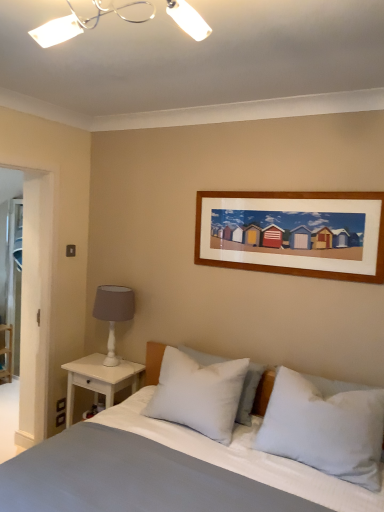
Question: Visually, is white matte table lamp at left positioned to the left or to the right of white plastic light fixture at upper center?

Choices:
 (A) left
 (B) right

Answer: (A)

Question: From a real-world perspective, is white matte table lamp at left above or below white plastic light fixture at upper center?

Choices:
 (A) above
 (B) below

Answer: (B)

Question: Which is nearer to the white soft pillow at center, which is counted as the third pillow, starting from the left?

Choices:
 (A) white wood nightstand at left
 (B) white soft pillow at center, the 2th pillow from the right
 (C) smooth cotton bed at center
 (D) white plastic light fixture at upper center
 (E) white painted wood shelf at left

Answer: (C)

Question: Which of these objects is positioned closest to the white soft pillow at center, which is the third pillow in right-to-left order?

Choices:
 (A) white plastic light fixture at upper center
 (B) white painted wood shelf at left
 (C) smooth cotton bed at center
 (D) white soft pillow at center, the 2th pillow from the left
 (E) white soft pillow at center, marked as the first pillow in a right-to-left arrangement

Answer: (D)